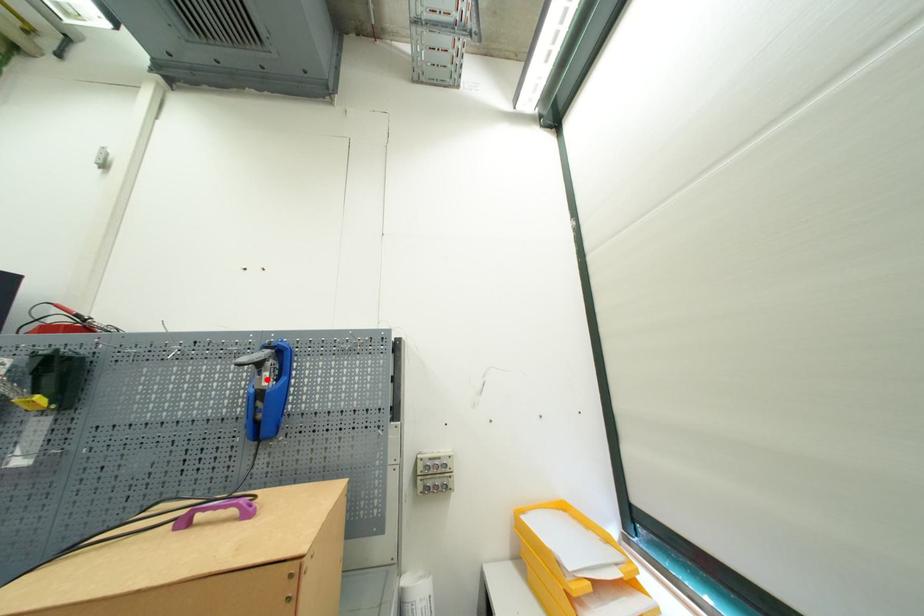
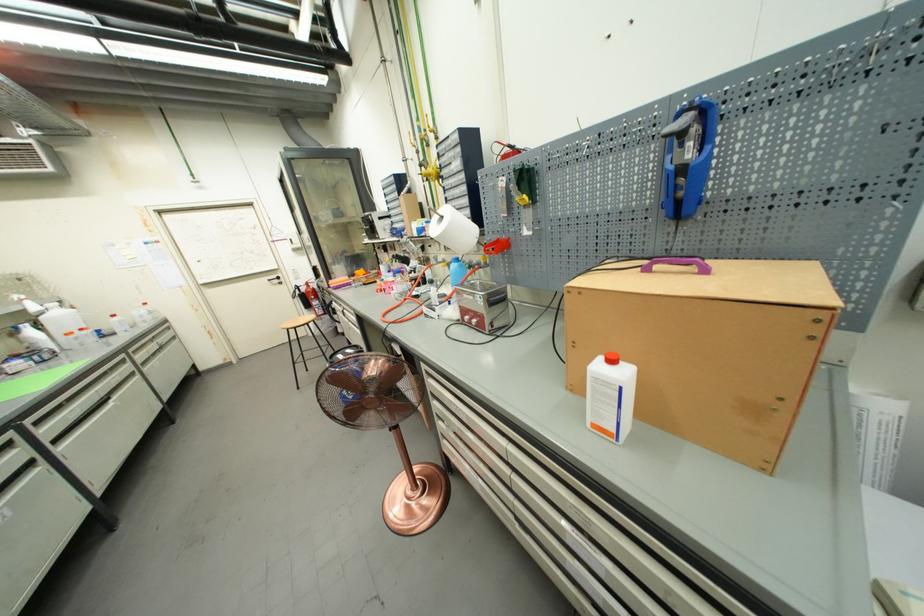
In the second image, find the point that corresponds to the highlighted location in the first image.

(689, 152)